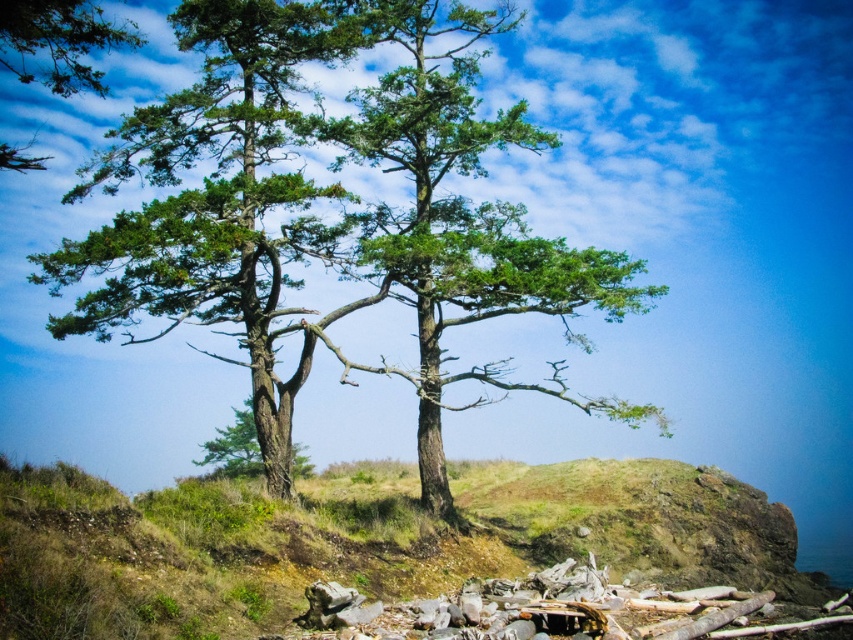
Question: Estimate the real-world distances between objects in this image. Which object is closer to the green rough bark tree at center?

Choices:
 (A) green grassy hillside at center
 (B) green textured tree at center
 (C) green matte tree at upper left

Answer: (A)

Question: Which object is positioned farthest from the green textured tree at center?

Choices:
 (A) green grassy hillside at center
 (B) green matte tree at upper left
 (C) green rough bark tree at center

Answer: (A)

Question: Can you confirm if green textured tree at center is smaller than green rough bark tree at center?

Choices:
 (A) no
 (B) yes

Answer: (A)

Question: Which point is closer to the camera?

Choices:
 (A) green textured tree at center
 (B) green grassy hillside at center
 (C) green matte tree at upper left

Answer: (B)

Question: Does green grassy hillside at center have a smaller size compared to green rough bark tree at center?

Choices:
 (A) no
 (B) yes

Answer: (A)

Question: Can you confirm if green textured tree at center is wider than green rough bark tree at center?

Choices:
 (A) no
 (B) yes

Answer: (B)